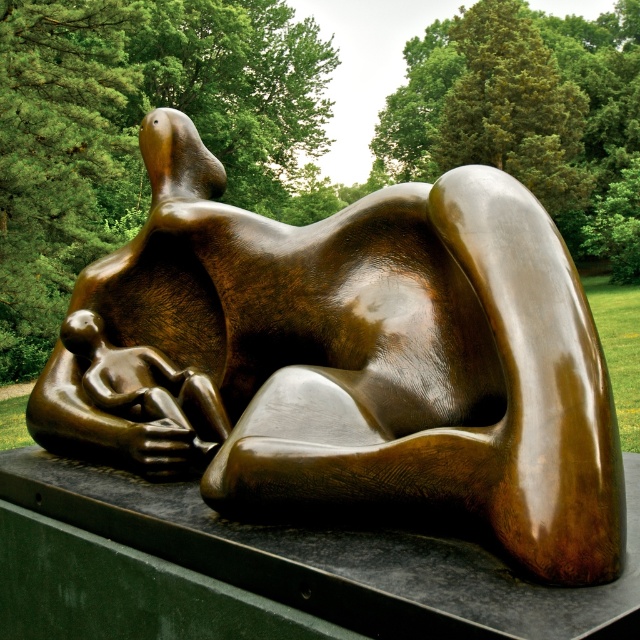
Who is lower down, bronze sculpture at center or matte bronze baby at lower left?

matte bronze baby at lower left is below.

Is point (404, 372) in front of point (196, 403)?

Yes.

Locate an element on the screen. This screenshot has width=640, height=640. bronze sculpture at center is located at coordinates (349, 358).